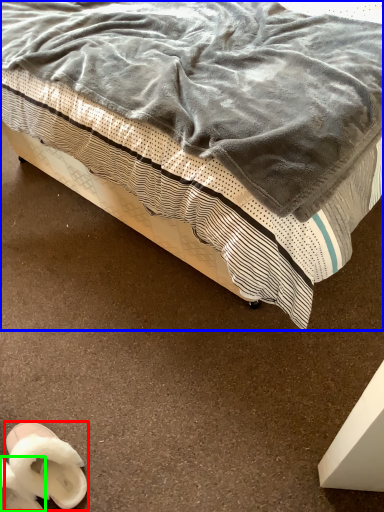
Question: Based on their relative distances, which object is farther from footwear (highlighted by a red box)? Choose from bed (highlighted by a blue box) and footwear (highlighted by a green box).

Choices:
 (A) bed
 (B) footwear

Answer: (A)